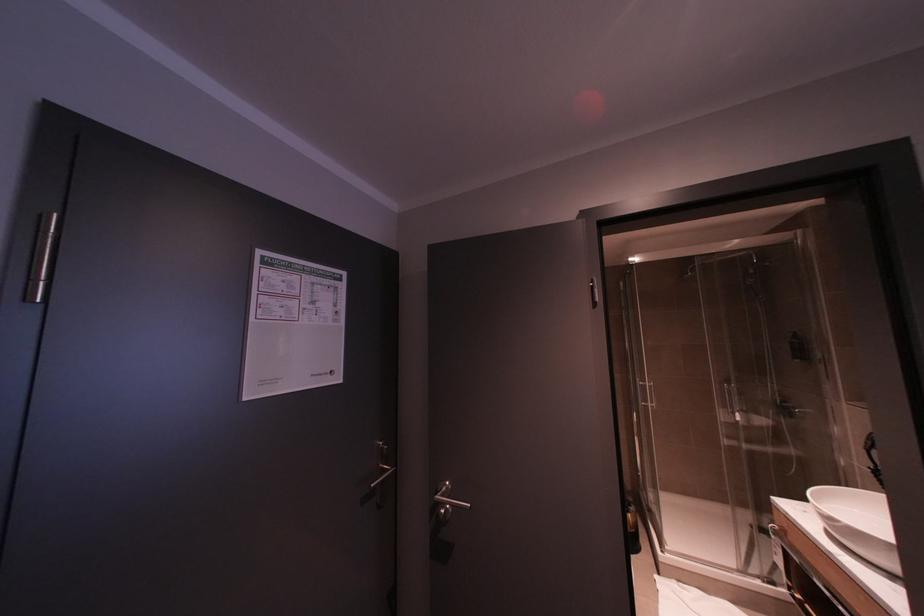
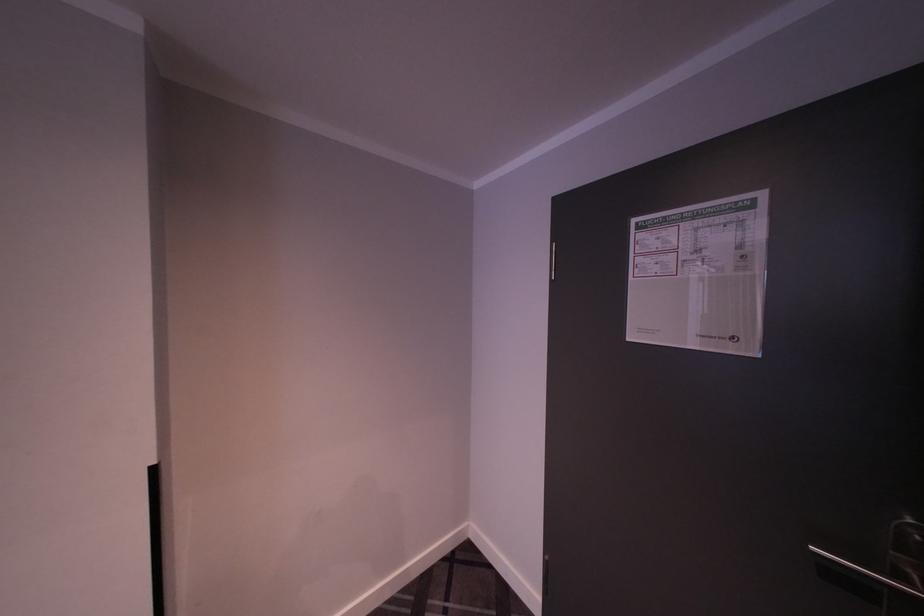
Question: The camera is either moving clockwise (left) or counter-clockwise (right) around the object. The first image is from the beginning of the video and the second image is from the end. Is the camera moving left or right when shooting the video?

Choices:
 (A) Left
 (B) Right

Answer: (B)